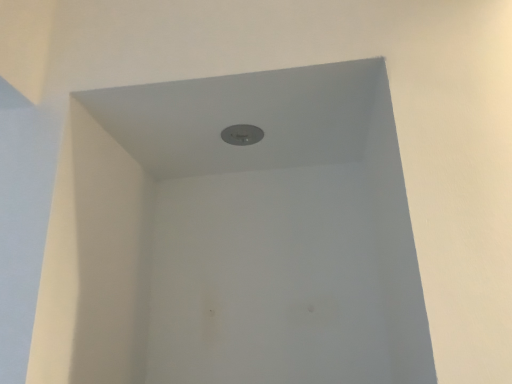
Question: Should I look upward or downward to see matte gray hole at center?

Choices:
 (A) down
 (B) up

Answer: (B)